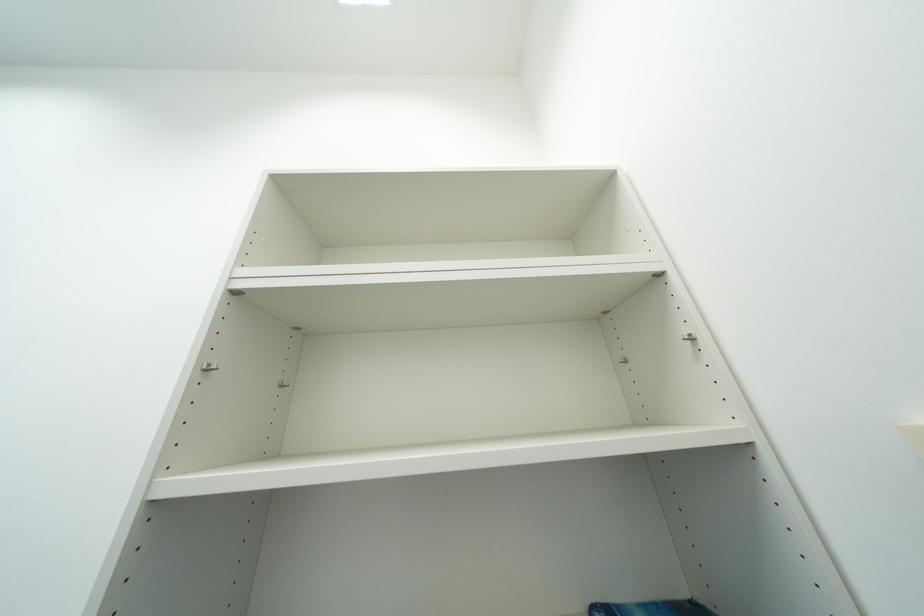
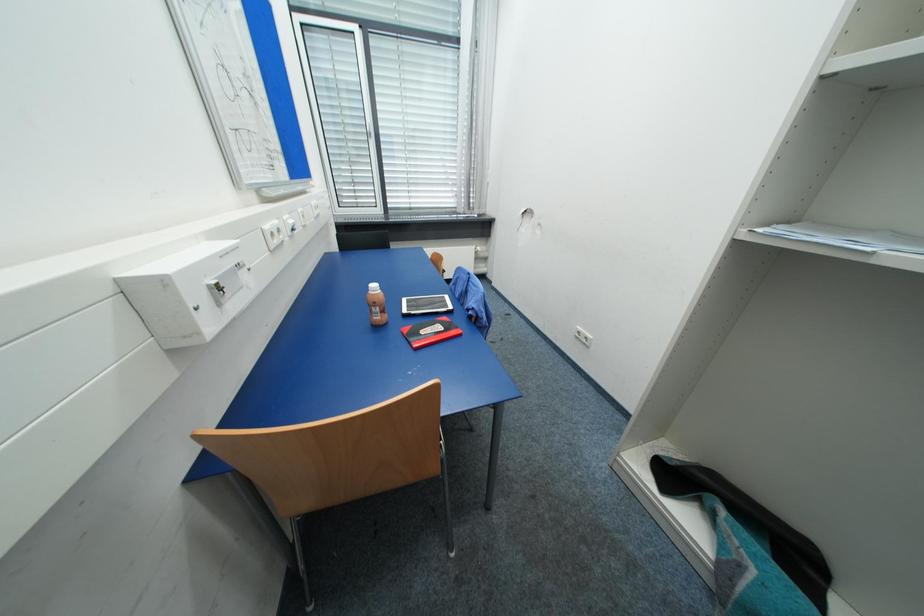
First-person continuous shooting, in which direction is the camera rotating?

The rotation direction of the camera is left-down.